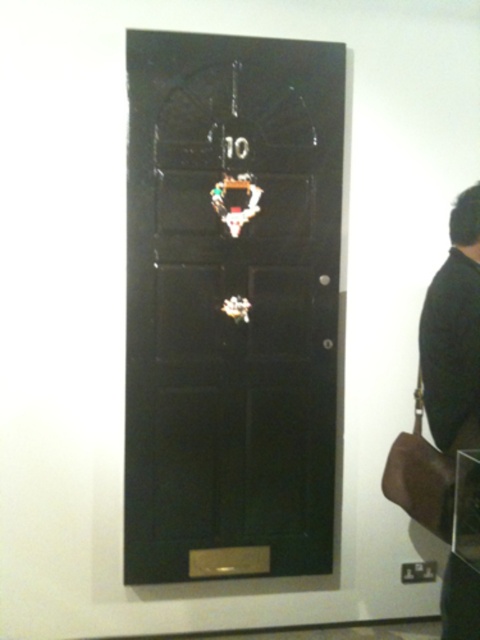
Question: Is glossy black door at center to the right of black leather jacket at right from the viewer's perspective?

Choices:
 (A) no
 (B) yes

Answer: (A)

Question: Which object is closer to the camera taking this photo?

Choices:
 (A) black leather jacket at right
 (B) glossy black door at center

Answer: (A)

Question: Does glossy black door at center appear on the left side of black leather jacket at right?

Choices:
 (A) yes
 (B) no

Answer: (A)

Question: Which point appears farthest from the camera in this image?

Choices:
 (A) (191, 385)
 (B) (471, 339)

Answer: (A)

Question: Which point is farther to the camera?

Choices:
 (A) glossy black door at center
 (B) black leather jacket at right

Answer: (A)

Question: Does glossy black door at center appear on the left side of black leather jacket at right?

Choices:
 (A) yes
 (B) no

Answer: (A)